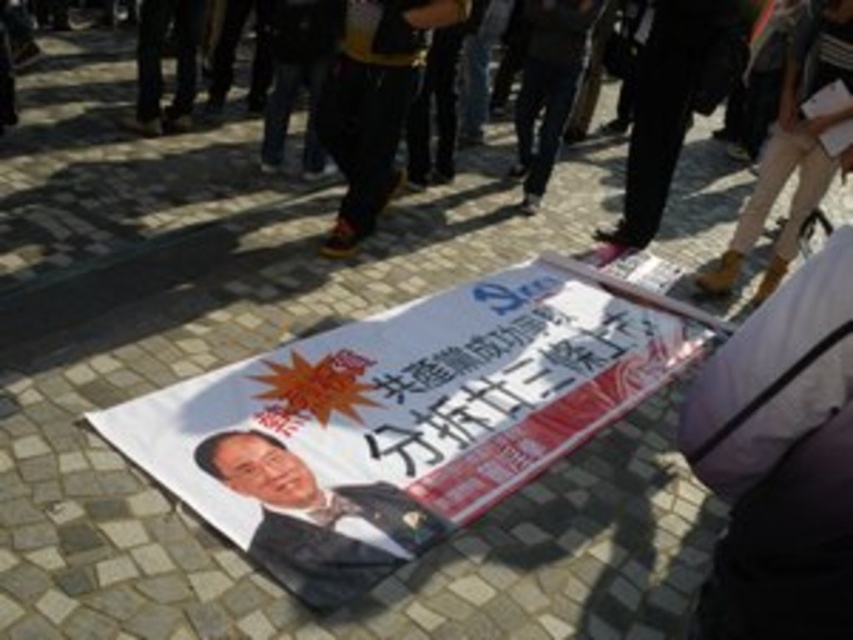
Between point (15, 170) and point (198, 449), which one is positioned in front?

Point (198, 449) is in front.

Between dark clothing at center and smooth black suit at center, which one is positioned higher?

dark clothing at center

Describe the element at coordinates (109, 164) in the screenshot. I see `dark clothing at center` at that location.

This screenshot has width=853, height=640. What are the coordinates of `dark clothing at center` in the screenshot? It's located at (109, 164).

How distant is white paper poster at center from dark clothing at center?

white paper poster at center is 7.54 feet from dark clothing at center.

Does point (396, 532) come farther from viewer compared to point (65, 131)?

No, (396, 532) is in front of (65, 131).

Who is more forward, (254, 460) or (196, 216)?

Positioned in front is point (254, 460).

At what (x,y) coordinates should I click in order to perform the action: click on white paper poster at center. Please return your answer as a coordinate pair (x, y). Looking at the image, I should click on (405, 417).

Can you confirm if white paper poster at center is bigger than smooth black suit at center?

Indeed, white paper poster at center has a larger size compared to smooth black suit at center.

Which is in front, point (316, 484) or point (390, 563)?

Positioned in front is point (390, 563).

This screenshot has height=640, width=853. Find the location of `white paper poster at center`. white paper poster at center is located at coordinates (405, 417).